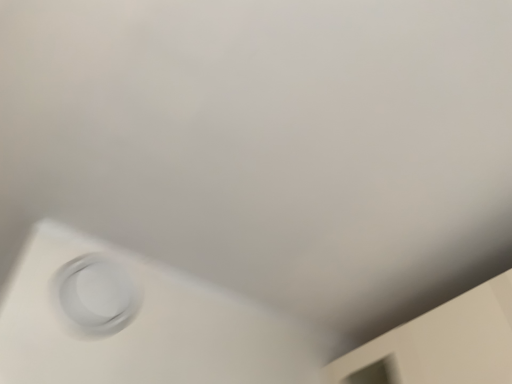
Where is `white matte hole at lower left`? The height and width of the screenshot is (384, 512). white matte hole at lower left is located at coordinates (94, 296).

What do you see at coordinates (94, 296) in the screenshot? The width and height of the screenshot is (512, 384). I see `white matte hole at lower left` at bounding box center [94, 296].

What is the approximate height of white matte hole at lower left?

The height of white matte hole at lower left is 8.12 inches.

I want to click on white matte hole at lower left, so click(94, 296).